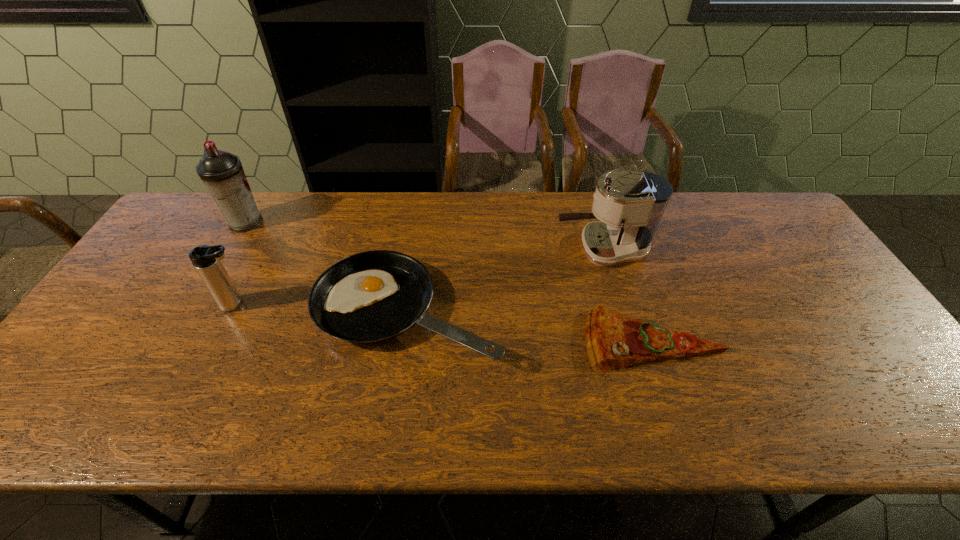
Image resolution: width=960 pixels, height=540 pixels. What are the coordinates of `free spot that satisfies the following two spatial constraints: 1. on the front-facing side of the shortest object; 2. on the right side of the coffee maker` in the screenshot? It's located at (628, 340).

Locate an element on the screen. The height and width of the screenshot is (540, 960). vacant region that satisfies the following two spatial constraints: 1. on the handle side of the third tallest object; 2. on the left side of the frying pan is located at coordinates (232, 313).

At what (x,y) coordinates should I click in order to perform the action: click on vacant position in the image that satisfies the following two spatial constraints: 1. on the back side of the frying pan; 2. on the handle side of the second object from left to right. Please return your answer as a coordinate pair (x, y). This screenshot has width=960, height=540. Looking at the image, I should click on (408, 305).

You are a GUI agent. You are given a task and a screenshot of the screen. Output one action in this format:
    pyautogui.click(x=<x>, y=<y>)
    Task: Click on the free point that satisfies the following two spatial constraints: 1. on the front-facing side of the shortest object; 2. on the left side of the coffee maker
    
    Given the screenshot: What is the action you would take?
    pos(628,340)